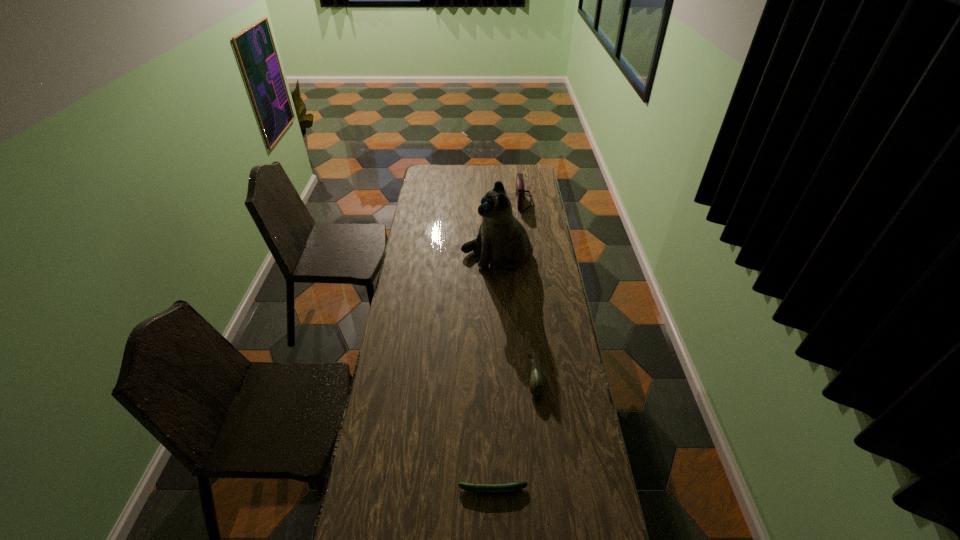
The width and height of the screenshot is (960, 540). What are the coordinates of `vacant position located 0.060m at the face of the cat` in the screenshot? It's located at (448, 256).

At what (x,y) coordinates should I click in order to perform the action: click on free space located 0.070m on the front flap of the shoulder bag. Please return your answer as a coordinate pair (x, y). Image resolution: width=960 pixels, height=540 pixels. Looking at the image, I should click on (503, 201).

The image size is (960, 540). Find the location of `vacant space located 0.190m on the front flap of the shoulder bag`. vacant space located 0.190m on the front flap of the shoulder bag is located at coordinates (482, 201).

At what (x,y) coordinates should I click in order to perform the action: click on vacant space located 0.060m on the front flap of the shoulder bag. Please return your answer as a coordinate pair (x, y). This screenshot has width=960, height=540. Looking at the image, I should click on 505,201.

At what (x,y) coordinates should I click in order to perform the action: click on vacant point located at the stem end of the second shortest object. Please return your answer as a coordinate pair (x, y). This screenshot has height=540, width=960. Looking at the image, I should click on (515, 377).

Locate an element on the screen. The image size is (960, 540). free space located 0.340m at the stem end of the second shortest object is located at coordinates pos(436,377).

Identify the location of free space located at the stem end of the second shortest object. Image resolution: width=960 pixels, height=540 pixels. (498, 377).

This screenshot has width=960, height=540. I want to click on vacant space located 0.090m on the front-facing side of the nearer zucchini, so click(x=428, y=489).

What are the coordinates of `vacant space located 0.270m on the front-facing side of the nearer zucchini` in the screenshot? It's located at (369, 489).

This screenshot has width=960, height=540. I want to click on vacant space located on the front-facing side of the nearer zucchini, so [401, 489].